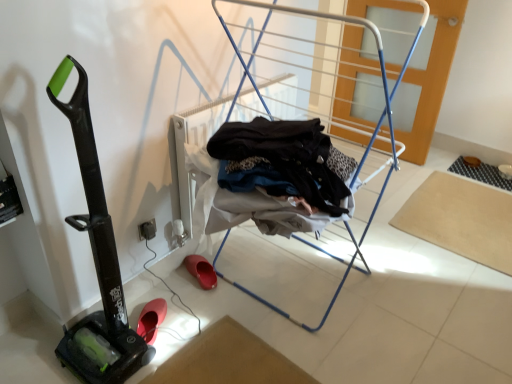
At what (x,y) coordinates should I click in order to perform the action: click on empty space that is in between rubber/soft sole shoe at lower left, which ranks as the first footwear in bottom-to-top order, and rubber/matte clog at lower left, the 1th footwear when ordered from top to bottom. Please return your answer as a coordinate pair (x, y). The image size is (512, 384). Looking at the image, I should click on (179, 292).